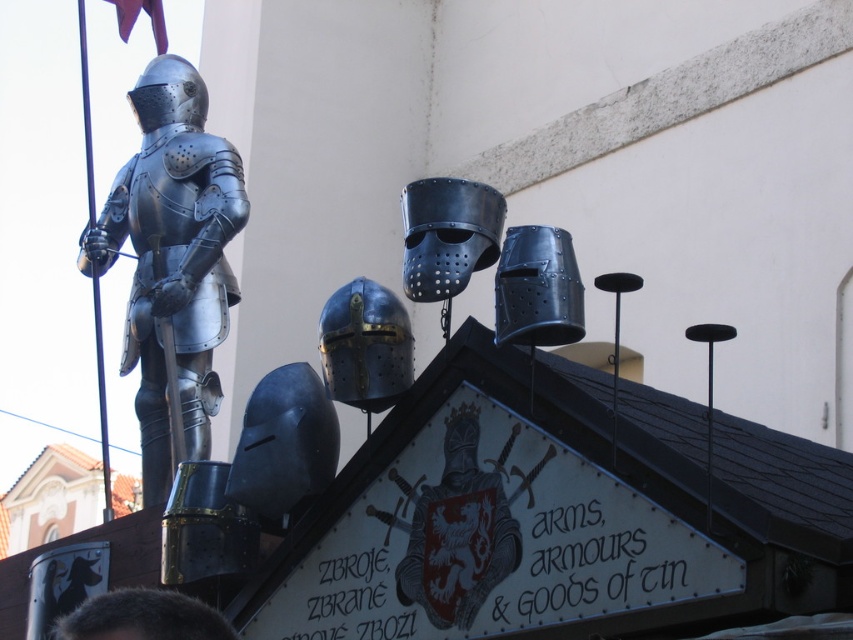
Looking at this image, who is positioned more to the left, black leather helmet at center or metallic blue helmet at center?

Positioned to the left is metallic blue helmet at center.

Does black leather helmet at center have a greater width compared to metallic blue helmet at center?

Indeed, black leather helmet at center has a greater width compared to metallic blue helmet at center.

Is point (461, 189) positioned after point (376, 321)?

No.

Find the location of a particular element. black leather helmet at center is located at coordinates (447, 234).

Looking at this image, can you confirm if shiny silver armor at left is positioned above polished silver armor at center?

Correct, shiny silver armor at left is located above polished silver armor at center.

Can you confirm if shiny silver armor at left is positioned to the right of polished silver armor at center?

In fact, shiny silver armor at left is to the left of polished silver armor at center.

Which is behind, point (163, 193) or point (442, 602)?

Point (163, 193)

Where is `shiny silver armor at left`? This screenshot has height=640, width=853. shiny silver armor at left is located at coordinates (172, 257).

Does metallic blue helmet at center have a lesser width compared to shiny metallic helmet at center?

In fact, metallic blue helmet at center might be wider than shiny metallic helmet at center.

From the picture: Who is positioned more to the right, metallic blue helmet at center or shiny metallic helmet at center?

shiny metallic helmet at center

What are the coordinates of `metallic blue helmet at center` in the screenshot? It's located at (364, 346).

What are the coordinates of `metallic blue helmet at center` in the screenshot? It's located at pyautogui.click(x=364, y=346).